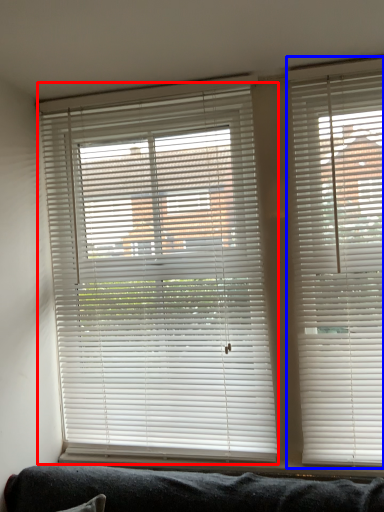
Question: Among these objects, which one is farthest to the camera, window blind (highlighted by a red box) or window blind (highlighted by a blue box)?

Choices:
 (A) window blind
 (B) window blind

Answer: (A)